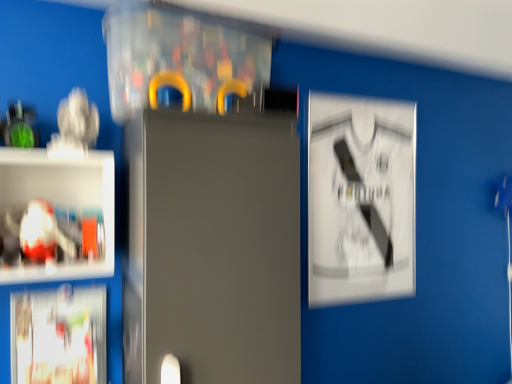
Question: From a real-world perspective, is transparent plastic cabinet at upper center over white paper at upper right, the 1th poster when ordered from back to front?

Choices:
 (A) yes
 (B) no

Answer: (A)

Question: Is transparent plastic cabinet at upper center with white paper at upper right, the 2th poster from the left?

Choices:
 (A) no
 (B) yes

Answer: (A)

Question: Considering the relative positions of transparent plastic cabinet at upper center and white paper at upper right, the 2th poster from the left, in the image provided, is transparent plastic cabinet at upper center in front of white paper at upper right, the 2th poster from the left,?

Choices:
 (A) yes
 (B) no

Answer: (A)

Question: Is transparent plastic cabinet at upper center not within white paper at upper right, acting as the 1th poster starting from the top?

Choices:
 (A) no
 (B) yes

Answer: (B)

Question: Is transparent plastic cabinet at upper center thinner than white paper at upper right, the 2th poster from the left?

Choices:
 (A) no
 (B) yes

Answer: (A)

Question: Considering the positions of white paper at upper right, acting as the 1th poster starting from the top, and satin gray fridge at center in the image, is white paper at upper right, acting as the 1th poster starting from the top, bigger or smaller than satin gray fridge at center?

Choices:
 (A) small
 (B) big

Answer: (A)

Question: From a real-world perspective, is white paper at upper right, the 2th poster from the left, positioned above or below satin gray fridge at center?

Choices:
 (A) below
 (B) above

Answer: (B)

Question: From the image's perspective, is white paper at upper right, the 2th poster when ordered from front to back, located above or below satin gray fridge at center?

Choices:
 (A) below
 (B) above

Answer: (B)

Question: In the image, is white paper at upper right, acting as the 1th poster starting from the top, on the left side or the right side of satin gray fridge at center?

Choices:
 (A) left
 (B) right

Answer: (B)

Question: Is transparent plastic cabinet at upper center bigger or smaller than white glossy poster at lower left, acting as the 2th poster starting from the back?

Choices:
 (A) small
 (B) big

Answer: (B)

Question: Choose the correct answer: Is transparent plastic cabinet at upper center inside white glossy poster at lower left, acting as the 2th poster starting from the back, or outside it?

Choices:
 (A) outside
 (B) inside

Answer: (A)

Question: Considering their positions, is transparent plastic cabinet at upper center located in front of or behind white glossy poster at lower left, the 1th poster when ordered from front to back?

Choices:
 (A) behind
 (B) front

Answer: (B)

Question: Is transparent plastic cabinet at upper center to the left or to the right of white glossy poster at lower left, acting as the 2th poster starting from the back, in the image?

Choices:
 (A) right
 (B) left

Answer: (A)

Question: Visually, is transparent plastic cabinet at upper center positioned to the left or to the right of white paper at upper right, the 2th poster from the left?

Choices:
 (A) left
 (B) right

Answer: (A)

Question: Based on their sizes in the image, would you say transparent plastic cabinet at upper center is bigger or smaller than white paper at upper right, acting as the 1th poster starting from the top?

Choices:
 (A) small
 (B) big

Answer: (B)